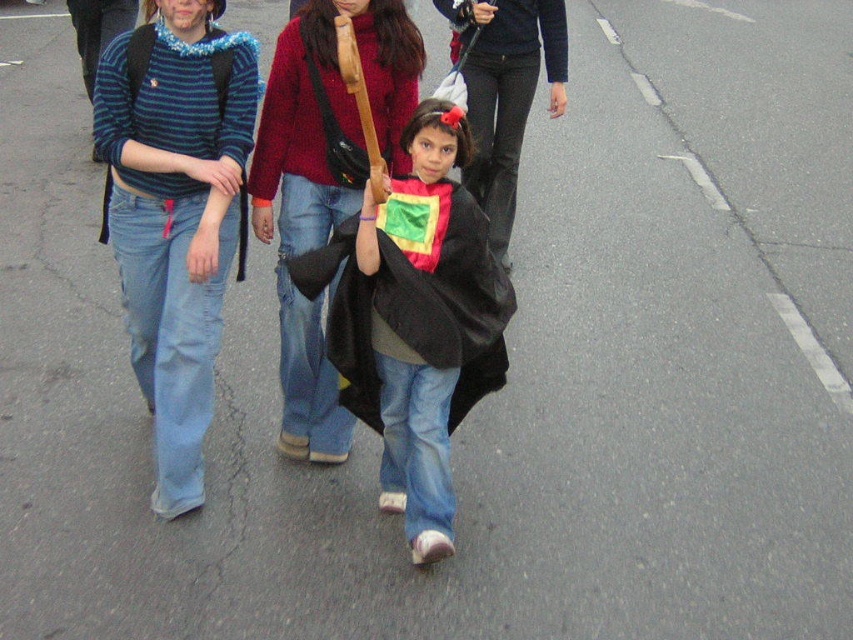
Is the position of matte red sweater at center more distant than that of matte black cape at center?

No.

Who is lower down, matte red sweater at center or matte black cape at center?

→ Positioned lower is matte red sweater at center.

Image resolution: width=853 pixels, height=640 pixels. In order to click on matte red sweater at center in this screenshot , I will do `click(323, 184)`.

Is striped knit sweater at left above matte black cape at center?

Actually, striped knit sweater at left is below matte black cape at center.

Is point (201, 316) less distant than point (480, 208)?

Yes, it is in front of point (480, 208).

Is point (154, 145) behind point (492, 205)?

No, (154, 145) is in front of (492, 205).

This screenshot has height=640, width=853. I want to click on striped knit sweater at left, so click(x=175, y=214).

Where is `striped knit sweater at left`? Image resolution: width=853 pixels, height=640 pixels. striped knit sweater at left is located at coordinates (175, 214).